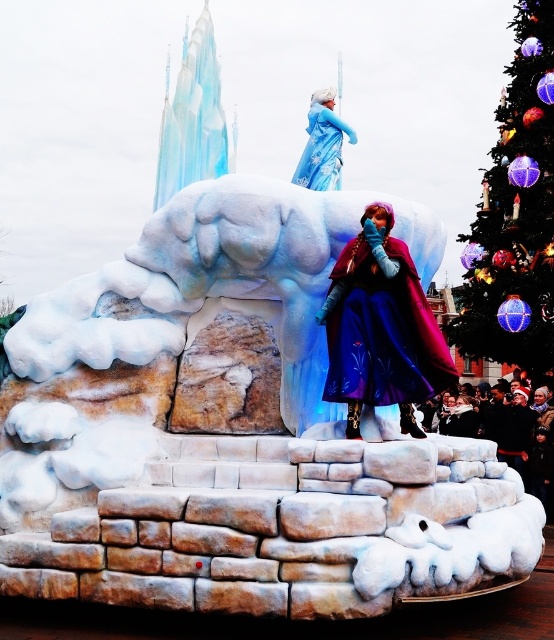
Question: Which point is closer to the camera taking this photo?

Choices:
 (A) (325, 131)
 (B) (546, 397)
 (C) (393, 243)

Answer: (C)

Question: Is iridescent glass ornaments at upper right behind velvet purple cape at center?

Choices:
 (A) no
 (B) yes

Answer: (B)

Question: Which of the following is the closest to the observer?

Choices:
 (A) (365, 289)
 (B) (310, 144)

Answer: (A)

Question: Can you confirm if velvet purple cape at center is smaller than matte blue dress at center?

Choices:
 (A) yes
 (B) no

Answer: (A)

Question: Among these points, which one is farthest from the camera?

Choices:
 (A) (408, 340)
 (B) (314, 182)
 (C) (510, 429)
 (D) (534, 320)

Answer: (D)

Question: Does iridescent glass ornaments at upper right appear over velvet purple cape at center?

Choices:
 (A) no
 (B) yes

Answer: (B)